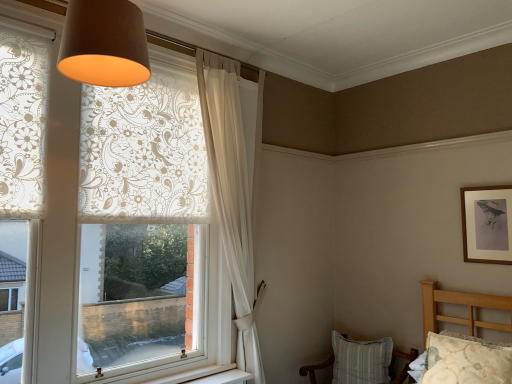
This screenshot has width=512, height=384. Describe the element at coordinates (104, 44) in the screenshot. I see `brown fabric lampshade at upper center` at that location.

What are the coordinates of `wooden framed print at upper right` in the screenshot? It's located at (487, 224).

Where is `white lace curtain at left`? This screenshot has width=512, height=384. white lace curtain at left is located at coordinates (151, 188).

Which object is more forward, floral fabric pillow at lower right or brown fabric lampshade at upper center?

brown fabric lampshade at upper center.

Between floral fabric pillow at lower right and brown fabric lampshade at upper center, which one appears on the right side from the viewer's perspective?

floral fabric pillow at lower right is more to the right.

Could you tell me if floral fabric pillow at lower right is facing brown fabric lampshade at upper center?

No, floral fabric pillow at lower right does not turn towards brown fabric lampshade at upper center.

Can you tell me how much floral fabric pillow at lower right and brown fabric lampshade at upper center differ in facing direction?

They differ by 89.5 degrees in their facing directions.

Considering the positions of points (179, 363) and (311, 365), is point (179, 363) farther from camera compared to point (311, 365)?

No.

Identify the location of window to the left of striped fabric chair at lower right. (151, 188).

From the picture: Can you confirm if white lace curtain at left is bigger than striped fabric chair at lower right?

Correct, white lace curtain at left is larger in size than striped fabric chair at lower right.

Could wooden framed print at upper right be considered to be inside brown fabric lampshade at upper center?

No, brown fabric lampshade at upper center does not contain wooden framed print at upper right.

Locate an element on the screen. The width and height of the screenshot is (512, 384). lamp above the wooden framed print at upper right (from a real-world perspective) is located at coordinates (104, 44).

Which object is further away from the camera taking this photo, brown fabric lampshade at upper center or wooden framed print at upper right?

wooden framed print at upper right is further from the camera.

From a real-world perspective, relative to wooden framed print at upper right, is brown fabric lampshade at upper center vertically above or below?

brown fabric lampshade at upper center is above wooden framed print at upper right.

What are the coordinates of `lamp in front of the white lace curtain at left` in the screenshot? It's located at (104, 44).

Visually, is brown fabric lampshade at upper center positioned to the left or to the right of white lace curtain at left?

From the image, it's evident that brown fabric lampshade at upper center is to the right of white lace curtain at left.

What's the angular difference between brown fabric lampshade at upper center and white lace curtain at left's facing directions?

The angle between the facing direction of brown fabric lampshade at upper center and the facing direction of white lace curtain at left is 0.706 degrees.

Is white lace curtain at left at the back of brown fabric lampshade at upper center?

Yes.

Is white lace curtain at left looking in the opposite direction of wooden framed print at upper right?

No, white lace curtain at left's orientation is not away from wooden framed print at upper right.

Considering the positions of point (178, 174) and point (479, 250), is point (178, 174) closer or farther from the camera than point (479, 250)?

Point (178, 174) is closer to the camera than point (479, 250).

Between white lace curtain at left and wooden framed print at upper right, which one has smaller width?

Thinner between the two is wooden framed print at upper right.

Is the depth of white sheer curtain at upper center less than that of striped fabric chair at lower right?

Yes, it is.

Which point is more forward, (234, 69) or (413, 348)?

The point (234, 69) is more forward.

How far apart are white sheer curtain at upper center and striped fabric chair at lower right?

The distance of white sheer curtain at upper center from striped fabric chair at lower right is 4.77 feet.

Is white sheer curtain at upper center facing towards striped fabric chair at lower right?

No, white sheer curtain at upper center does not turn towards striped fabric chair at lower right.

Does striped fabric chair at lower right have a lesser height compared to floral fabric pillow at lower right?

Incorrect, the height of striped fabric chair at lower right does not fall short of that of floral fabric pillow at lower right.

Considering the positions of objects striped fabric chair at lower right and floral fabric pillow at lower right in the image provided, who is behind, striped fabric chair at lower right or floral fabric pillow at lower right?

striped fabric chair at lower right is more distant.

Locate an element on the screen. The width and height of the screenshot is (512, 384). chair on the left of the floral fabric pillow at lower right is located at coordinates (315, 369).

Which object is wider, striped fabric chair at lower right or floral fabric pillow at lower right?

With larger width is striped fabric chair at lower right.

The height and width of the screenshot is (384, 512). Identify the location of pillow on the right of brown fabric lampshade at upper center. (465, 361).

The image size is (512, 384). In order to click on window above the striped fabric chair at lower right (from the image's perspective) in this screenshot , I will do `click(151, 188)`.

Considering their positions, is brown fabric lampshade at upper center positioned closer to wooden framed print at upper right than floral fabric pillow at lower right?

Based on the image, floral fabric pillow at lower right appears to be nearer to wooden framed print at upper right.

From the image, which object appears to be nearer to brown fabric lampshade at upper center, white lace curtain at left or striped fabric chair at lower right?

white lace curtain at left is positioned closer to the anchor brown fabric lampshade at upper center.

Looking at the image, which one is located closer to white lace curtain at left, brown fabric lampshade at upper center or floral fabric pillow at lower right?

Based on the image, brown fabric lampshade at upper center appears to be nearer to white lace curtain at left.

Looking at the image, which one is located further to striped fabric chair at lower right, floral fabric pillow at lower right or brown fabric lampshade at upper center?

The object further to striped fabric chair at lower right is brown fabric lampshade at upper center.

From the image, which object appears to be nearer to brown fabric lampshade at upper center, wooden framed print at upper right or striped fabric chair at lower right?

Based on the image, wooden framed print at upper right appears to be nearer to brown fabric lampshade at upper center.

Which object lies nearer to the anchor point white sheer curtain at upper center, white lace curtain at left or floral fabric pillow at lower right?

white lace curtain at left lies closer to white sheer curtain at upper center than the other object.

When comparing their distances from floral fabric pillow at lower right, does wooden framed print at upper right or brown fabric lampshade at upper center seem further?

The object further to floral fabric pillow at lower right is brown fabric lampshade at upper center.

Which object lies further to the anchor point striped fabric chair at lower right, wooden framed print at upper right or floral fabric pillow at lower right?

wooden framed print at upper right lies further to striped fabric chair at lower right than the other object.

Where is `window between brown fabric lampshade at upper center and striped fabric chair at lower right vertically`? The image size is (512, 384). window between brown fabric lampshade at upper center and striped fabric chair at lower right vertically is located at coordinates (151, 188).

Identify the location of chair between white lace curtain at left and wooden framed print at upper right from left to right. The height and width of the screenshot is (384, 512). (315, 369).

In order to click on lamp situated between white lace curtain at left and floral fabric pillow at lower right from left to right in this screenshot , I will do `click(104, 44)`.

Identify the location of pillow between white lace curtain at left and wooden framed print at upper right from left to right. (465, 361).